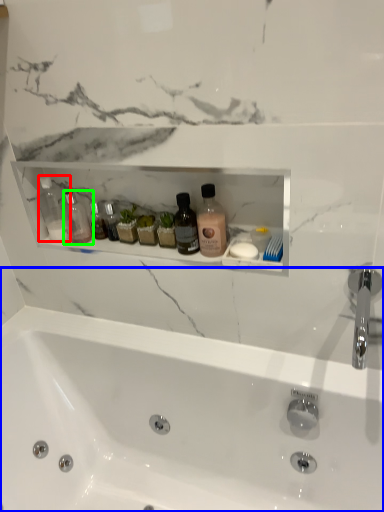
Question: Estimate the real-world distances between objects in this image. Which object is closer to toiletry (highlighted by a red box), bathtub (highlighted by a blue box) or toiletry (highlighted by a green box)?

Choices:
 (A) bathtub
 (B) toiletry

Answer: (B)